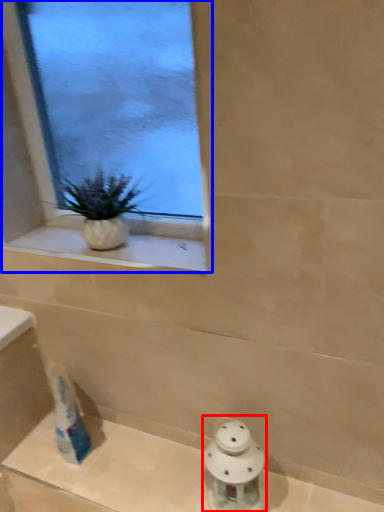
Question: Which object is further to the camera taking this photo, porcelain (highlighted by a red box) or window (highlighted by a blue box)?

Choices:
 (A) porcelain
 (B) window

Answer: (A)